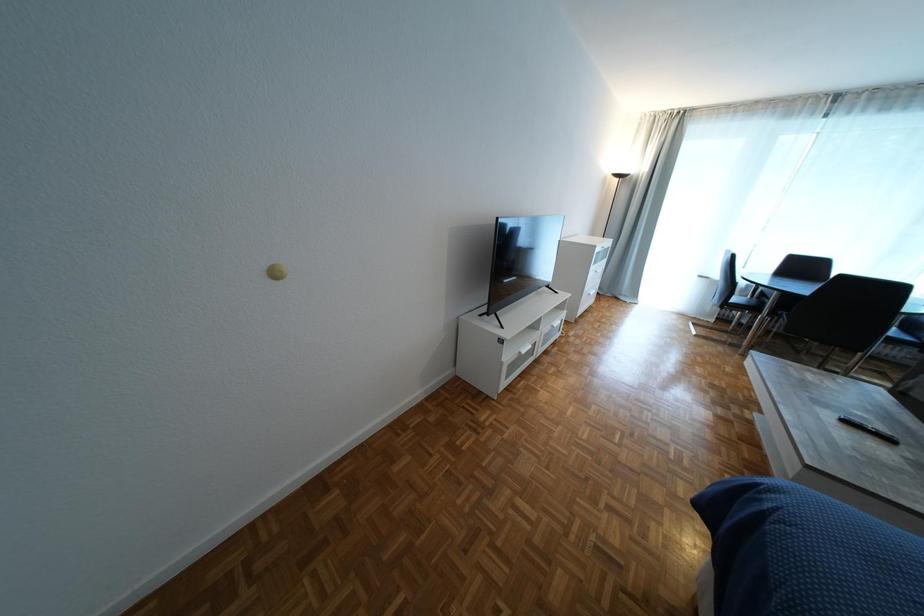
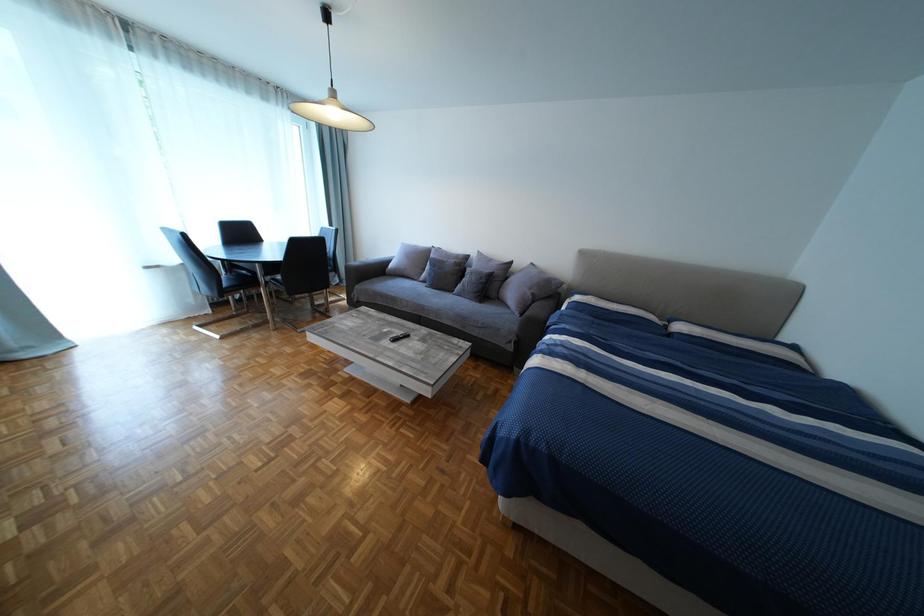
First-person continuous shooting, in which direction is the camera rotating?

The rotation direction of the camera is right-down.